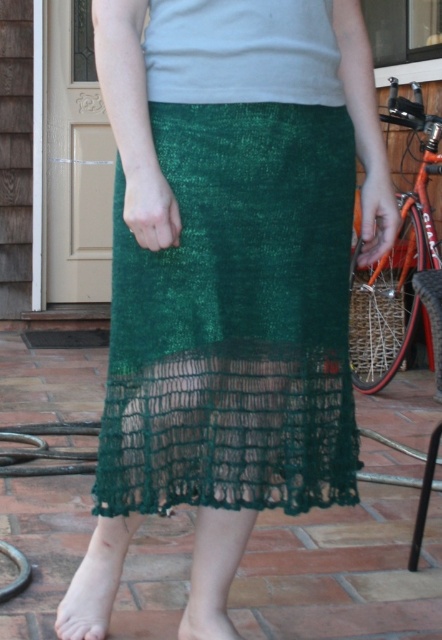
Does green lace foot at lower center appear over green knitted sock at lower center?

Correct, green lace foot at lower center is located above green knitted sock at lower center.

Looking at this image, is green lace foot at lower center positioned at the back of green knitted sock at lower center?

Yes, green lace foot at lower center is further from the viewer.

At what (x,y) coordinates should I click in order to perform the action: click on green lace foot at lower center. Please return your answer as a coordinate pair (x, y). Looking at the image, I should click on (91, 593).

Locate an element on the screen. The height and width of the screenshot is (640, 442). green lace foot at lower center is located at coordinates (91, 593).